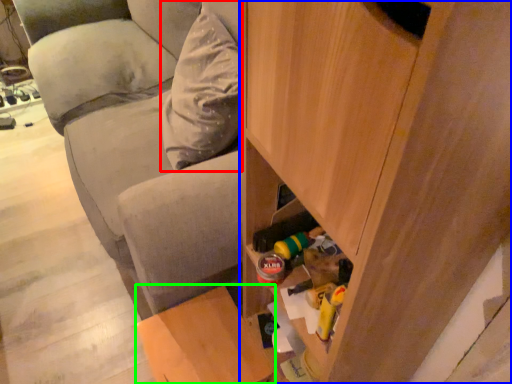
Question: Considering the real-world distances, which object is closest to pillow (highlighted by a red box)? cabinetry (highlighted by a blue box) or furniture (highlighted by a green box).

Choices:
 (A) cabinetry
 (B) furniture

Answer: (B)